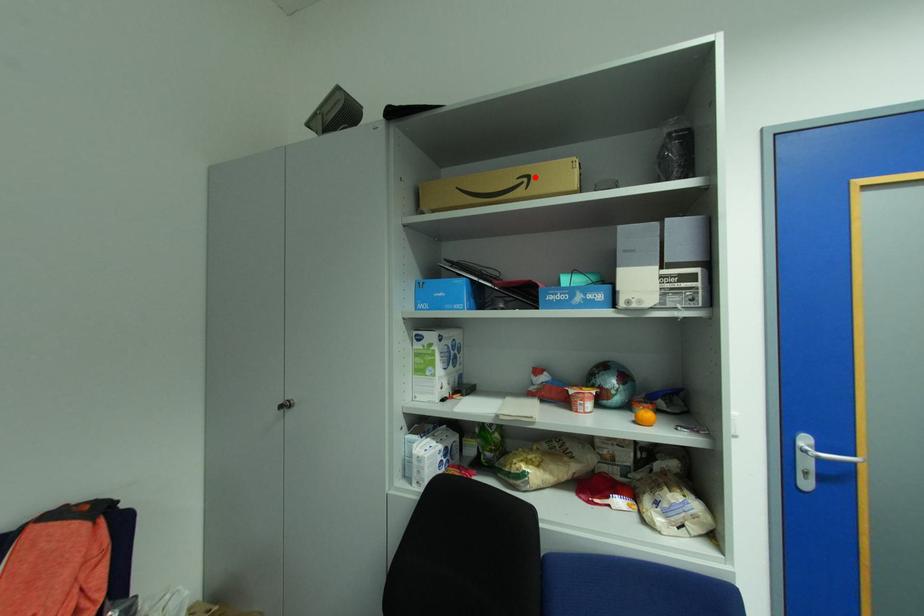
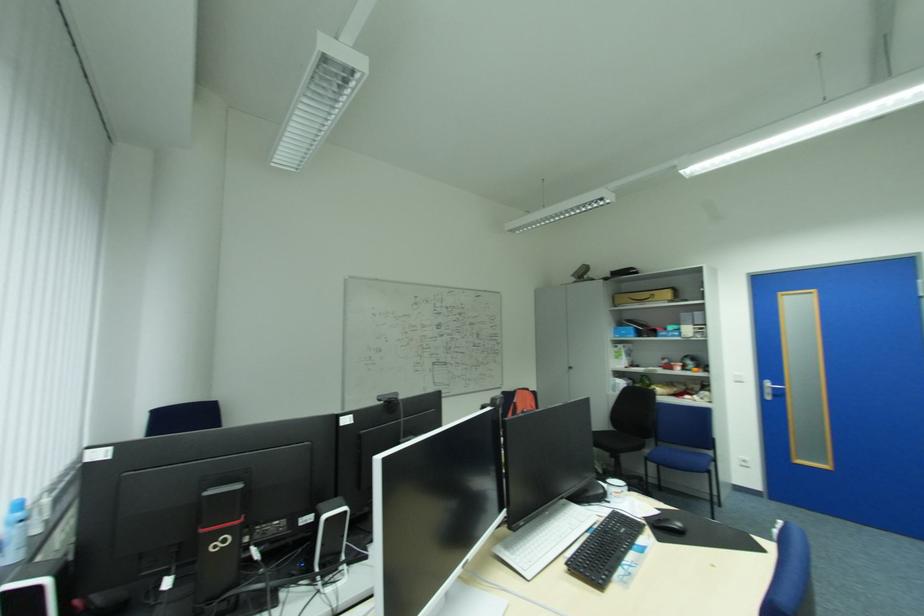
The point at the highlighted location is marked in the first image. Where is the corresponding point in the second image?

(659, 294)